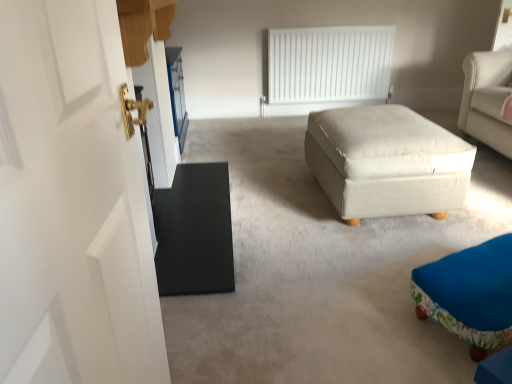
Find the location of a particular element. This screenshot has width=512, height=384. free spot to the right of black matte table at left, the 2th table when ordered from right to left is located at coordinates (310, 220).